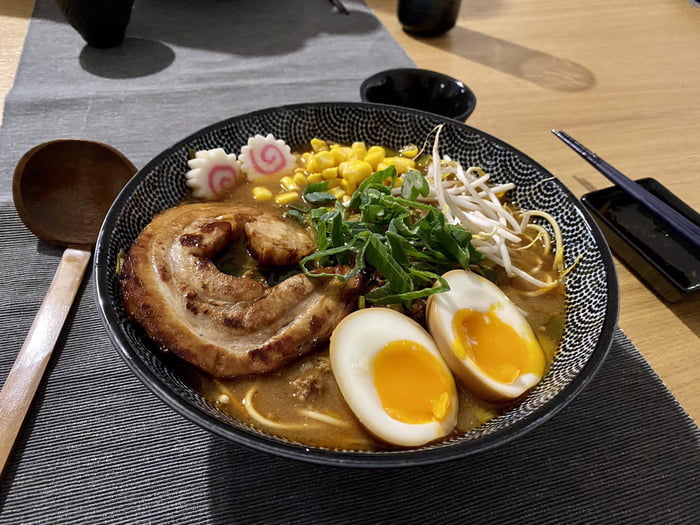
Where is `placemat`? Image resolution: width=700 pixels, height=525 pixels. placemat is located at coordinates (78, 487).